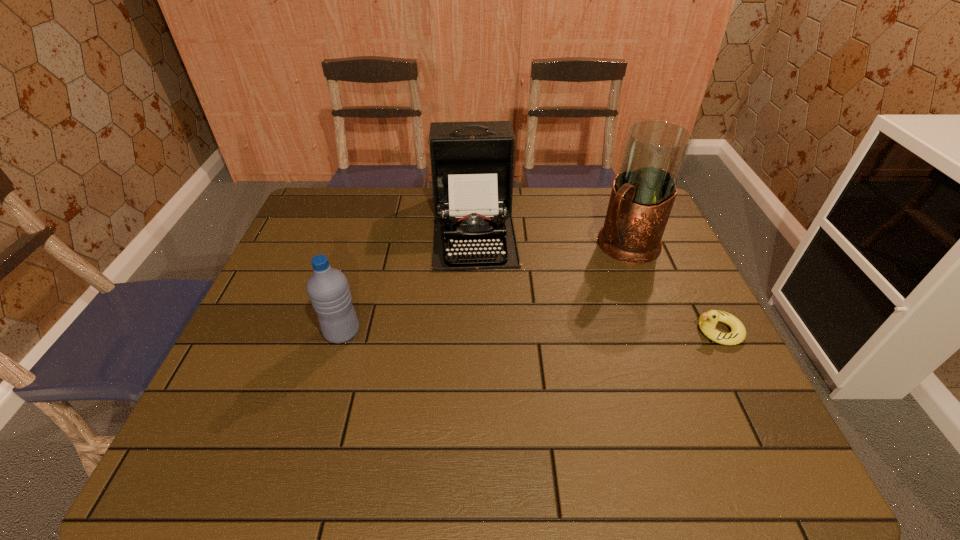
Where is `the leftmost object`? This screenshot has height=540, width=960. the leftmost object is located at coordinates (328, 289).

Where is `water bottle`? The height and width of the screenshot is (540, 960). water bottle is located at coordinates (328, 289).

Find the location of a particular element. duckling is located at coordinates (707, 322).

Locate an element on the screen. pitcher is located at coordinates (643, 193).

Where is `typewriter`? Image resolution: width=960 pixels, height=540 pixels. typewriter is located at coordinates (472, 163).

Locate an element on the screen. the third object from right to left is located at coordinates (472, 163).

Image resolution: width=960 pixels, height=540 pixels. I want to click on vacant region located 0.090m on the back of the water bottle, so click(x=353, y=294).

You are a GUI agent. You are given a task and a screenshot of the screen. Output one action in this format:
    pyautogui.click(x=<x>, y=<y>)
    Task: Click on the vacant space situated 0.140m on the face of the shortest object
    
    Given the screenshot: What is the action you would take?
    pyautogui.click(x=638, y=330)

The width and height of the screenshot is (960, 540). What are the coordinates of `free space located on the face of the shortest object` in the screenshot? It's located at 590,330.

Where is `free spot located 0.280m on the face of the shortest object`? The image size is (960, 540). free spot located 0.280m on the face of the shortest object is located at coordinates (583, 330).